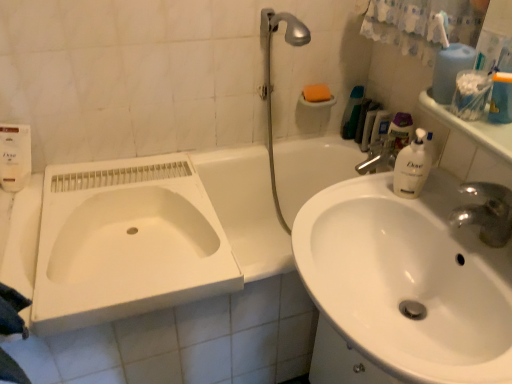
Question: Should I look upward or downward to see white plastic bottle at upper right, the second toiletry in the left-to-right sequence?

Choices:
 (A) down
 (B) up

Answer: (B)

Question: Is white plastic bottle at upper right, the second toiletry in the left-to-right sequence, in front of white plastic container at upper right?

Choices:
 (A) no
 (B) yes

Answer: (A)

Question: Is white plastic bottle at upper right, placed as the first toiletry when sorted from right to left, positioned behind white plastic container at upper right?

Choices:
 (A) no
 (B) yes

Answer: (B)

Question: Would you say white plastic bottle at upper right, the second toiletry in the left-to-right sequence, is outside white plastic container at upper right?

Choices:
 (A) no
 (B) yes

Answer: (B)

Question: Does white plastic bottle at upper right, placed as the first toiletry when sorted from right to left, have a larger size compared to white plastic container at upper right?

Choices:
 (A) yes
 (B) no

Answer: (B)

Question: Is white plastic bottle at upper right, placed as the first toiletry when sorted from right to left, smaller than white plastic container at upper right?

Choices:
 (A) yes
 (B) no

Answer: (A)

Question: Would you say white plastic container at upper right is part of white plastic bottle at upper right, placed as the first toiletry when sorted from right to left,'s contents?

Choices:
 (A) yes
 (B) no

Answer: (B)

Question: From a real-world perspective, is white plastic bottle at upper right, placed as the first toiletry when sorted from right to left, under clear plastic bottle at upper right, the second mouthwash viewed from the left?

Choices:
 (A) yes
 (B) no

Answer: (A)

Question: Is white plastic bottle at upper right, placed as the first toiletry when sorted from right to left, in contact with clear plastic bottle at upper right, the second mouthwash viewed from the left?

Choices:
 (A) yes
 (B) no

Answer: (A)

Question: Is white plastic bottle at upper right, the second toiletry in the left-to-right sequence, thinner than clear plastic bottle at upper right, the 2th mouthwash viewed from the front?

Choices:
 (A) no
 (B) yes

Answer: (A)

Question: From the image's perspective, does white plastic bottle at upper right, placed as the first toiletry when sorted from right to left, appear higher than clear plastic bottle at upper right, the second mouthwash viewed from the left?

Choices:
 (A) no
 (B) yes

Answer: (A)

Question: Is clear plastic bottle at upper right, the 2th mouthwash viewed from the front, at the back of white plastic bottle at upper right, placed as the first toiletry when sorted from right to left?

Choices:
 (A) yes
 (B) no

Answer: (A)

Question: Is white plastic bottle at upper right, placed as the first toiletry when sorted from right to left, bigger than clear plastic bottle at upper right, the 1th mouthwash in the back-to-front sequence?

Choices:
 (A) no
 (B) yes

Answer: (B)

Question: Is clear plastic container at upper right, the first mouthwash when ordered from left to right, not close to silver metallic shower head at upper right?

Choices:
 (A) yes
 (B) no

Answer: (B)